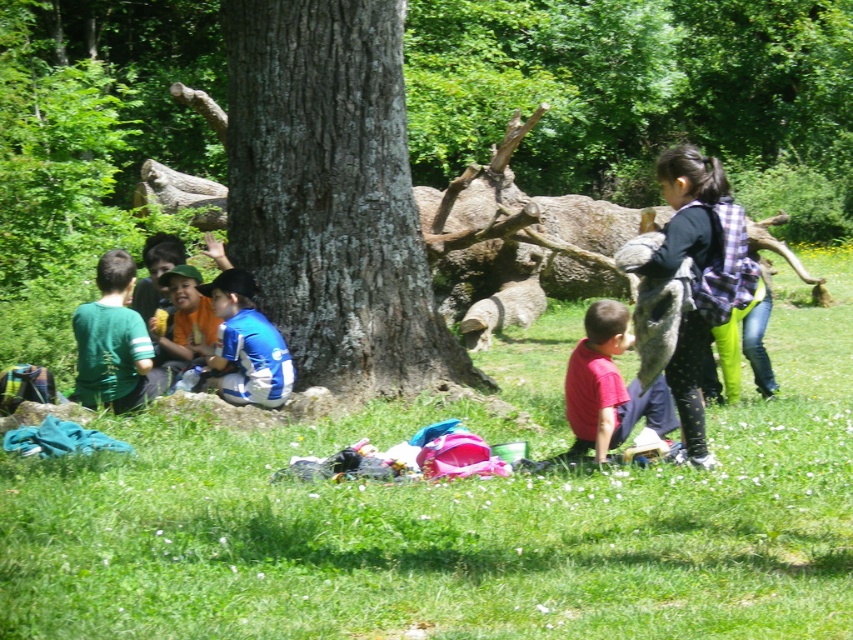
Question: Which point appears closest to the camera in this image?

Choices:
 (A) [x=172, y=276]
 (B) [x=363, y=36]
 (C) [x=231, y=618]

Answer: (C)

Question: Does green grass at lower center appear on the right side of matte orange shirt at center?

Choices:
 (A) yes
 (B) no

Answer: (A)

Question: Does green matte shirt at left appear over matte orange shirt at center?

Choices:
 (A) no
 (B) yes

Answer: (A)

Question: Where is green grass at lower center located in relation to matte orange shirt at center in the image?

Choices:
 (A) right
 (B) left

Answer: (A)

Question: Which object is farther from the camera taking this photo?

Choices:
 (A) plaid fabric backpack at right
 (B) blue jersey at center

Answer: (B)

Question: Which of the following is the closest to the observer?

Choices:
 (A) (77, 342)
 (B) (254, 332)
 (C) (706, 166)

Answer: (C)